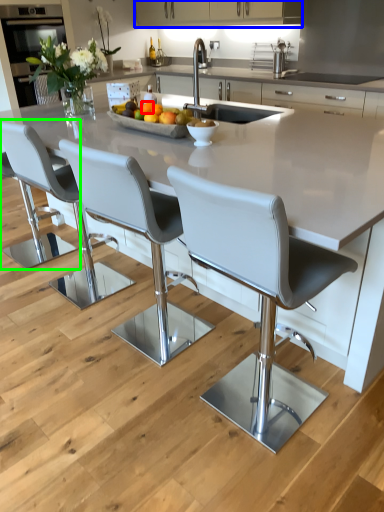
Question: Which is nearer to the orange (highlighted by a red box)? cabinetry (highlighted by a blue box) or chair (highlighted by a green box).

Choices:
 (A) cabinetry
 (B) chair

Answer: (B)